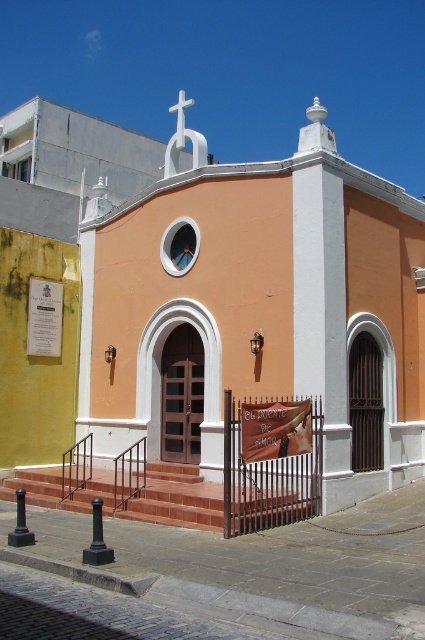
Question: Among these points, which one is nearest to the camera?

Choices:
 (A) (36, 387)
 (B) (70, 509)

Answer: (B)

Question: Can you confirm if matte orange church at center is positioned below terracotta brick stairs at center?

Choices:
 (A) yes
 (B) no

Answer: (B)

Question: Is the position of matte orange church at center more distant than that of terracotta brick stairs at center?

Choices:
 (A) yes
 (B) no

Answer: (B)

Question: Can you confirm if matte orange church at center is smaller than terracotta brick stairs at center?

Choices:
 (A) no
 (B) yes

Answer: (A)